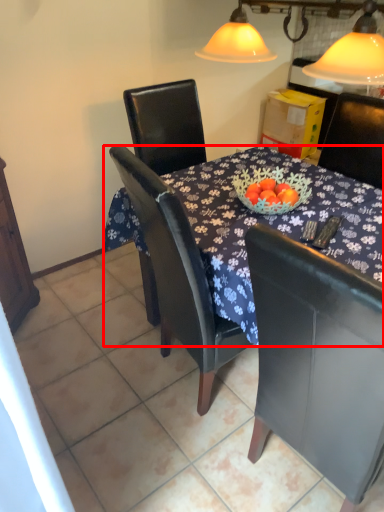
Question: From the image's perspective, what is the correct spatial positioning of desk (annotated by the red box) in reference to chair?

Choices:
 (A) above
 (B) below

Answer: (A)